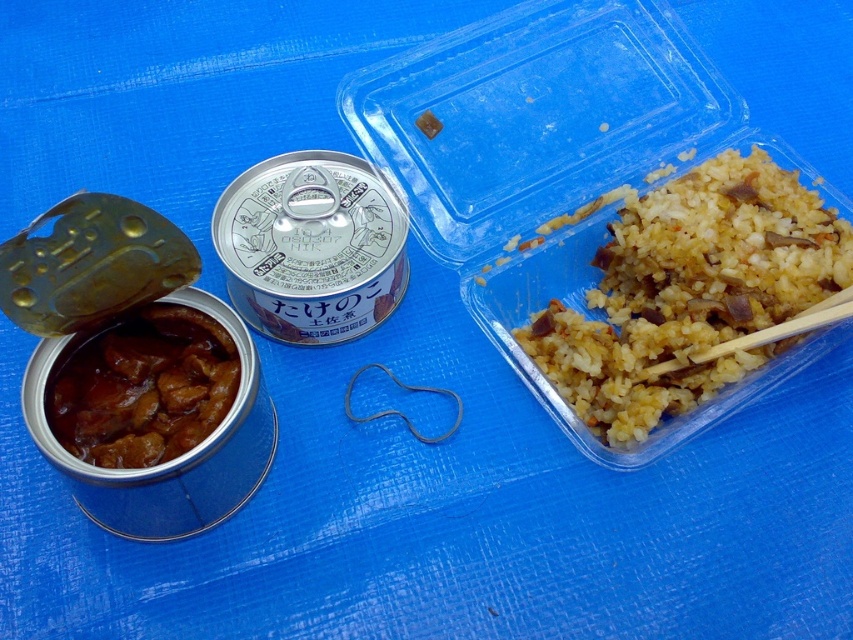
Is point (717, 262) less distant than point (129, 417)?

That is False.

In order to click on brown rice at right in this screenshot , I will do `click(689, 292)`.